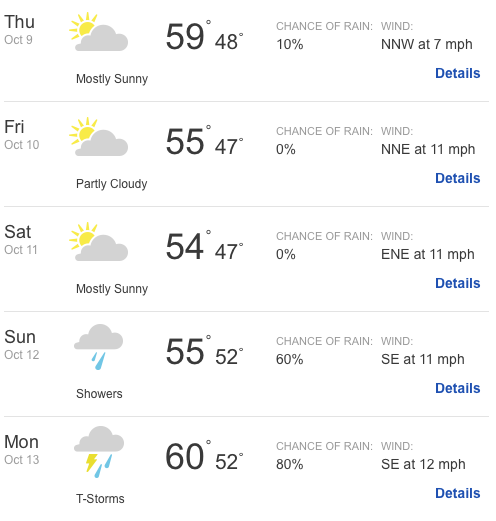
Find the location of `showers`. showers is located at coordinates (98, 340).